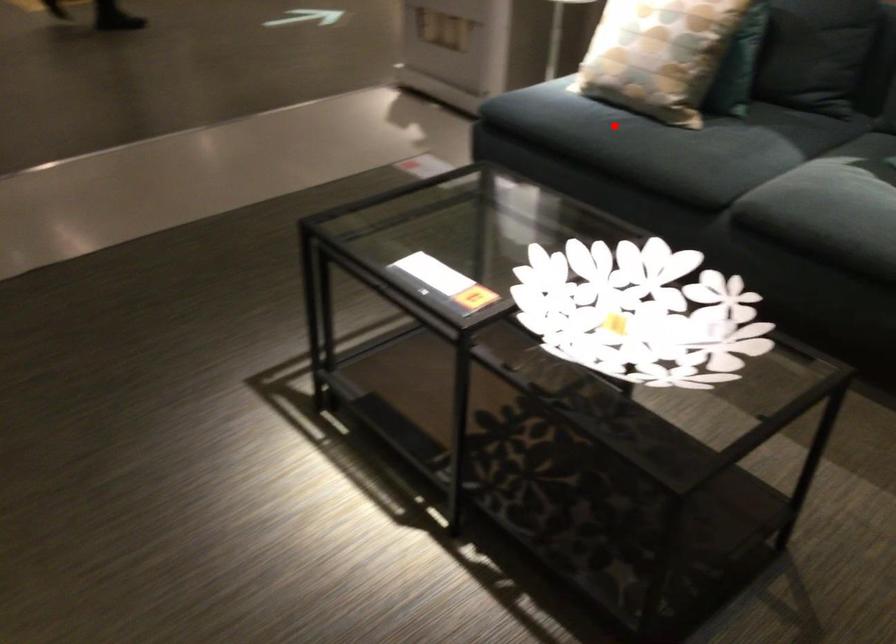
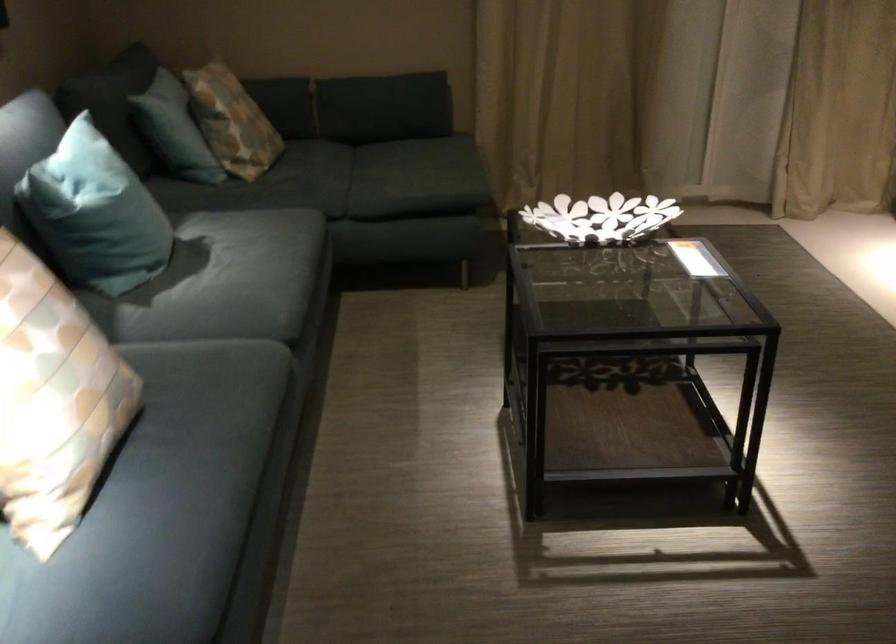
Question: I am providing you with two images of the same scene from different viewpoints. Given a red point in image1, look at the same physical point in image2. Is it:

Choices:
 (A) Closer to the viewpoint
 (B) Farther from the viewpoint

Answer: (A)